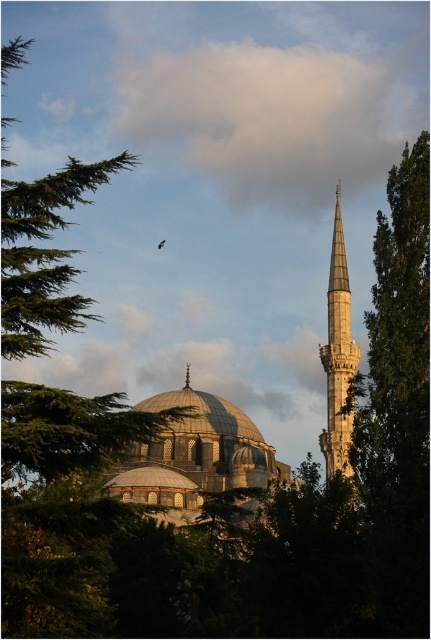
You are standing in front of the mosque and notice the white fluffy cloud at upper center. Based on its position in the sky, can you determine if it is directly above the dome or the minaret?

The white fluffy cloud at upper center is located at point coordinates that place it above the dome, so it is directly above the dome.

You are an architect designing a new mosque and want to ensure the silver metallic spire at center is visible against the sky. Considering the white fluffy cloud at upper center, will the spire be obscured by the cloud?

The white fluffy cloud at upper center has a larger width than the silver metallic spire at center, so the spire might be partially obscured by the cloud depending on their positions.